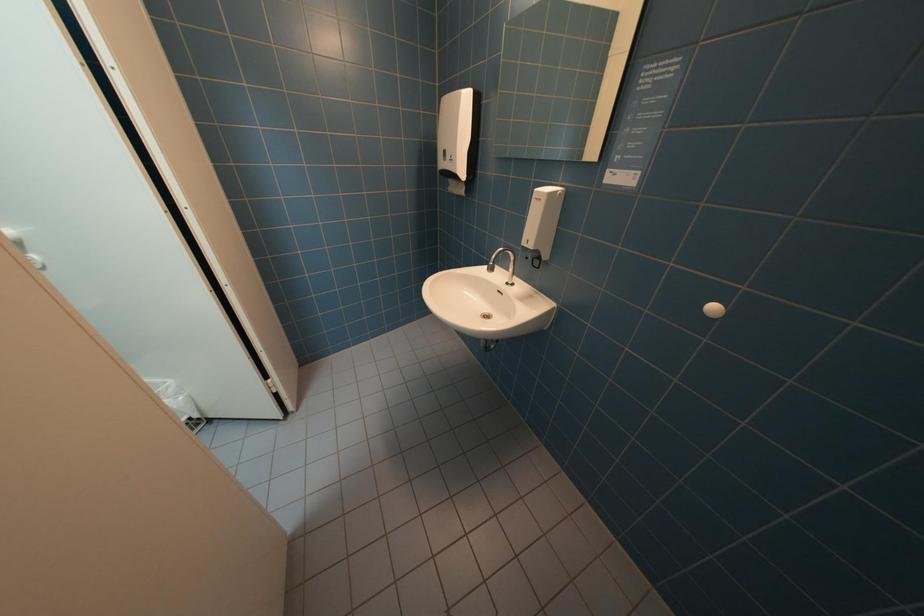
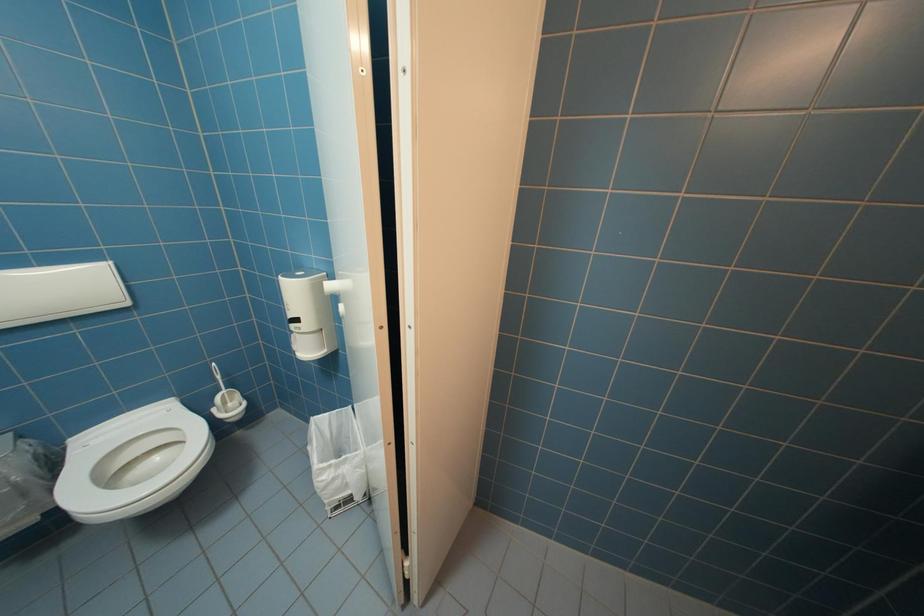
Question: The camera is either moving clockwise (left) or counter-clockwise (right) around the object. The first image is from the beginning of the video and the second image is from the end. Is the camera moving left or right when shooting the video?

Choices:
 (A) Left
 (B) Right

Answer: (B)